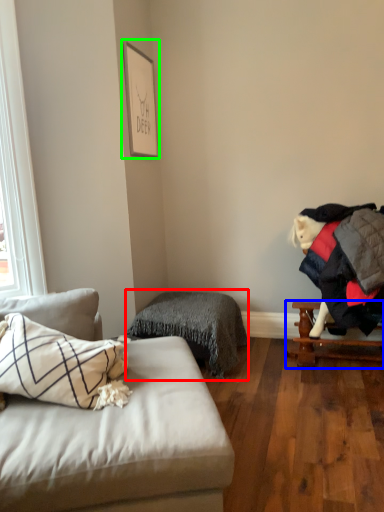
Question: Which object is positioned closest to bedding (highlighted by a red box)? Select from table (highlighted by a blue box) and picture frame (highlighted by a green box).

Choices:
 (A) table
 (B) picture frame

Answer: (A)